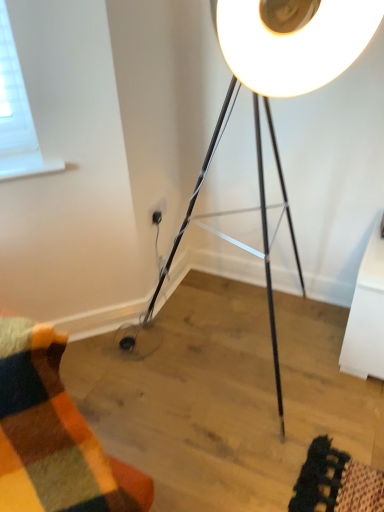
This screenshot has height=512, width=384. I want to click on wooden floor mat at lower left, so click(x=53, y=435).

Describe the element at coordinates (53, 435) in the screenshot. I see `wooden floor mat at lower left` at that location.

Where is `wooden floor mat at lower left`? The width and height of the screenshot is (384, 512). wooden floor mat at lower left is located at coordinates pyautogui.click(x=53, y=435).